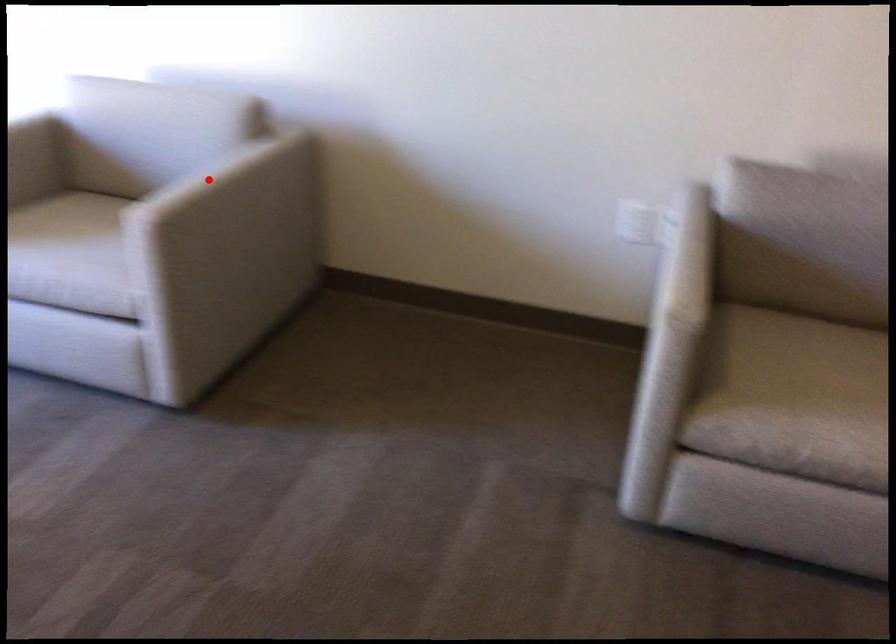
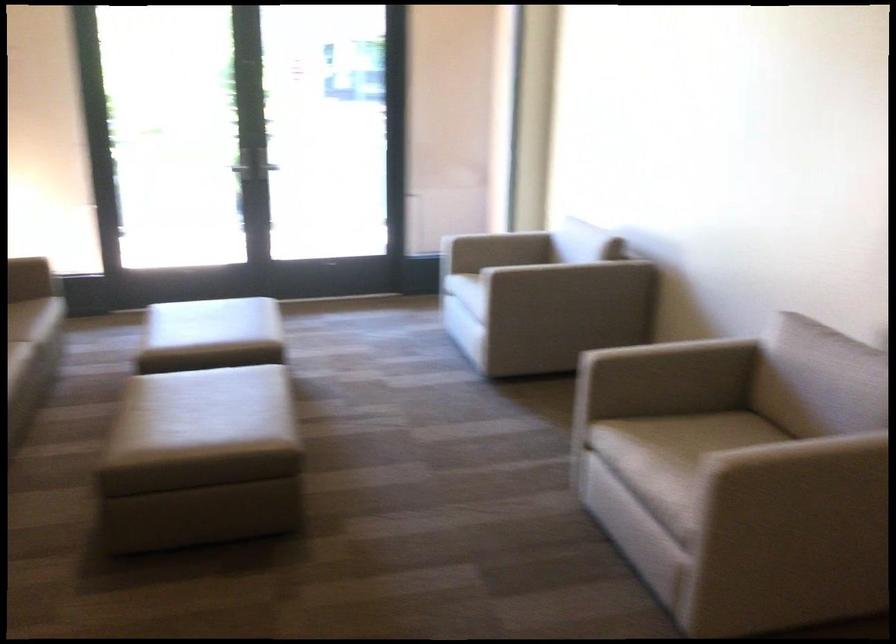
Question: A red point is marked in image1. In image2, is the corresponding 3D point closer to the camera or farther? Reply with the corresponding letter.

Choices:
 (A) The corresponding 3D point is closer.
 (B) The corresponding 3D point is farther.

Answer: (B)